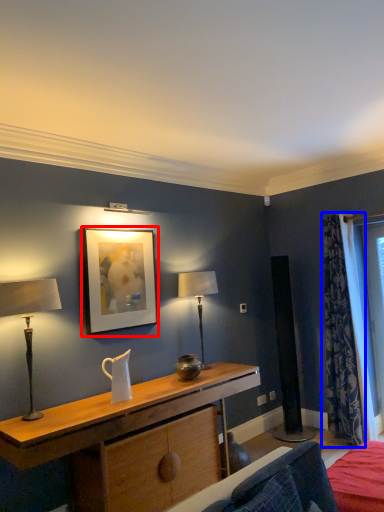
Question: Which point is further to the camera, picture frame (highlighted by a red box) or curtain (highlighted by a blue box)?

Choices:
 (A) picture frame
 (B) curtain

Answer: (B)